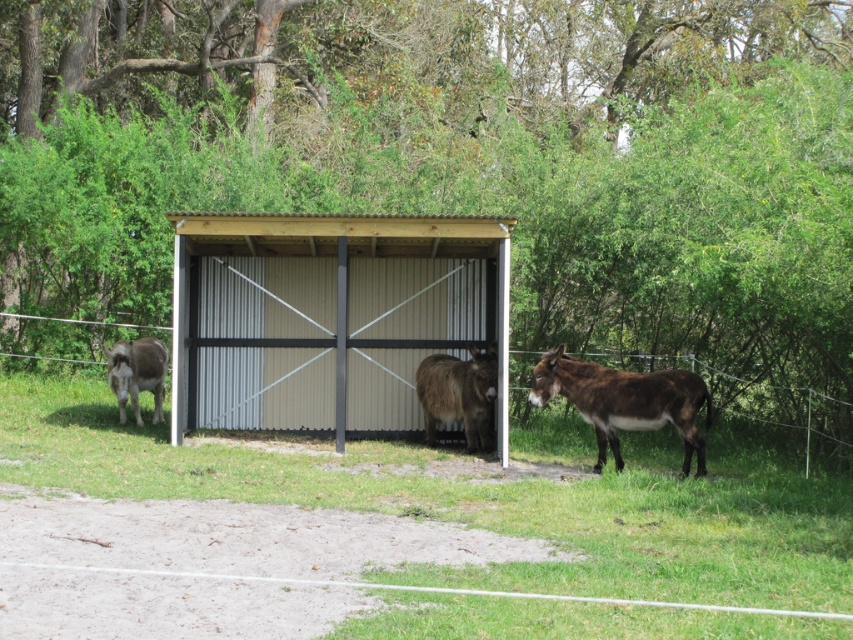
Based on the photo, you are a farmer who wants to move the brown fuzzy mule at center to a spot where it can be shaded from the sun. The shelter has a roof but no walls. Which direction should you move the mule to ensure it stays under the shelter while remaining on the green grass at center?

The green grass at center is larger in size than brown fuzzy mule at center, so moving the mule to the area under the shelter while staying on the green grass at center would work since the grass is spacious enough to accommodate the mule under the shelter.

You are a farmer who wants to load hay onto a cart. The cart is near the shelter entrance. Which brown fuzzy mule at right or brown fuzzy mule at center would you choose to pull the cart if you need the taller one?

The brown fuzzy mule at right is much taller than the brown fuzzy mule at center, so you should choose the brown fuzzy mule at right to pull the cart.